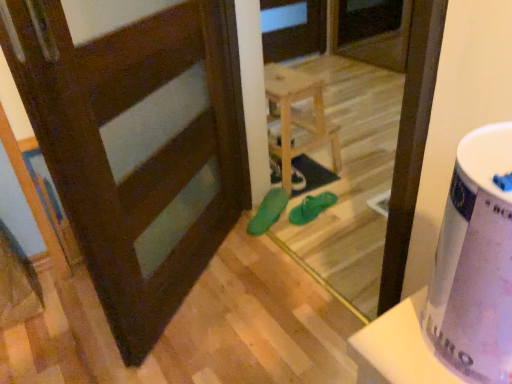
The image size is (512, 384). Identify the location of space that is in front of green rubber sandals at center, arranged as the 1th footwear when viewed from the left. click(x=292, y=235).